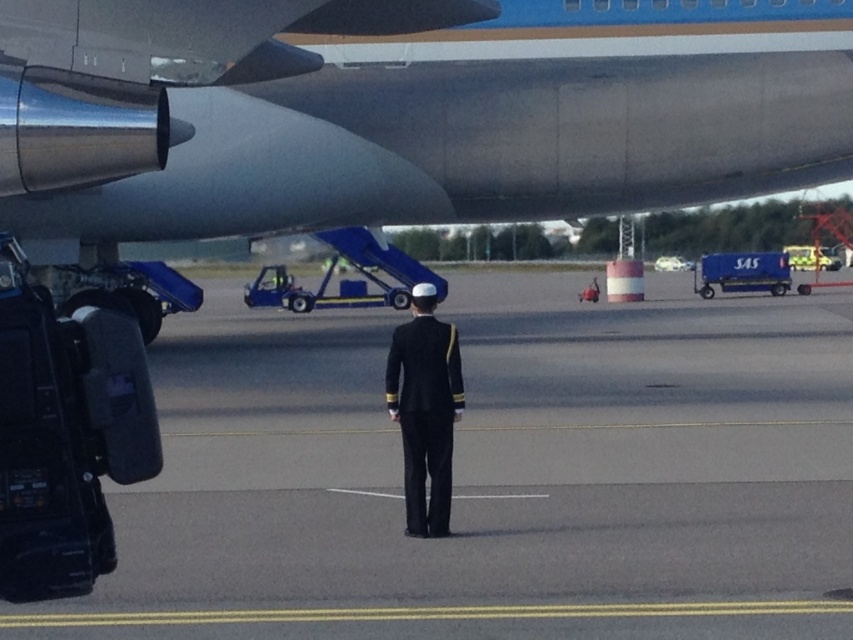
In the scene shown: Measure the distance between metallic gray airplane at upper center and camera.

6.49 meters

Where is `metallic gray airplane at upper center`? This screenshot has height=640, width=853. metallic gray airplane at upper center is located at coordinates (405, 112).

What are the coordinates of `metallic gray airplane at upper center` in the screenshot? It's located at (405, 112).

Who is lower down, black smooth tarmac at center or navy blue uniform at center?

black smooth tarmac at center is lower down.

Who is taller, black smooth tarmac at center or navy blue uniform at center?

Standing taller between the two is navy blue uniform at center.

The height and width of the screenshot is (640, 853). What do you see at coordinates (494, 474) in the screenshot?
I see `black smooth tarmac at center` at bounding box center [494, 474].

The image size is (853, 640). In order to click on black smooth tarmac at center in this screenshot , I will do click(x=494, y=474).

Is point (511, 372) positioned after point (93, 164)?

Yes, point (511, 372) is farther from viewer.

Can you confirm if black smooth tarmac at center is shorter than metallic gray airplane at upper center?

Yes, black smooth tarmac at center is shorter than metallic gray airplane at upper center.

Locate an element on the screen. black smooth tarmac at center is located at coordinates (494, 474).

I want to click on black smooth tarmac at center, so click(494, 474).